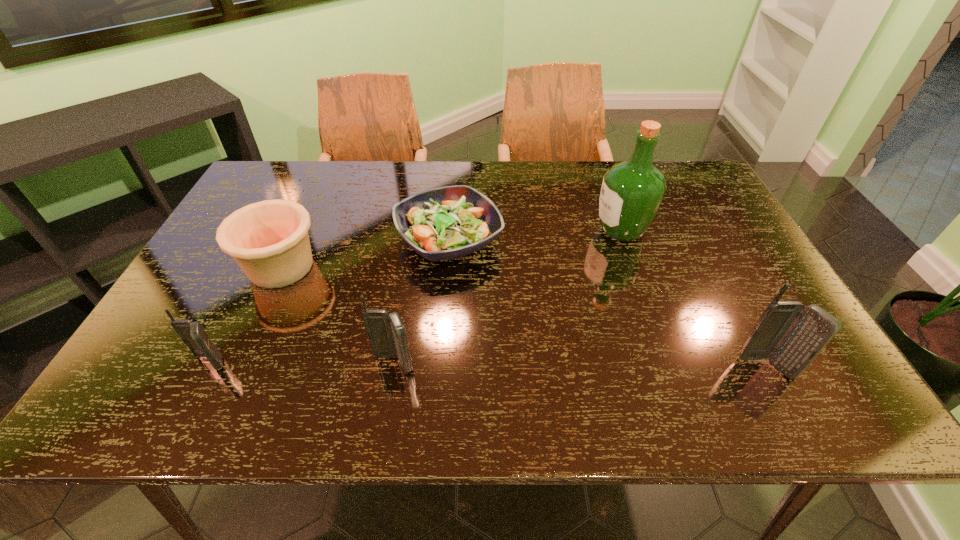
Please determine a free point for an extra cellular_telephone to ensure balance. Please provide its 2D coordinates. Your answer should be formatted as a tuple, i.e. [(x, y)], where the tuple contains the x and y coordinates of a point satisfying the conditions above.

[(580, 366)]